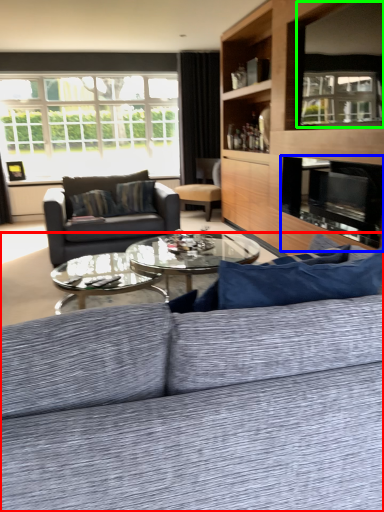
Question: Considering the real-world distances, which object is farthest from studio couch (highlighted by a red box)? fireplace (highlighted by a blue box) or window screen (highlighted by a green box)?

Choices:
 (A) fireplace
 (B) window screen

Answer: (B)